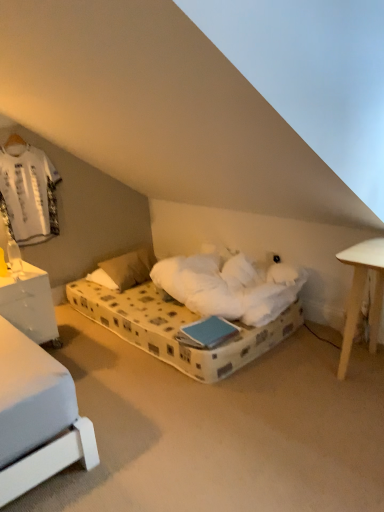
Question: Is white glossy nightstand at left to the left of white plastic table lamp at left from the viewer's perspective?

Choices:
 (A) no
 (B) yes

Answer: (B)

Question: From a real-world perspective, is white glossy nightstand at left located higher than white plastic table lamp at left?

Choices:
 (A) yes
 (B) no

Answer: (B)

Question: Can you see white glossy nightstand at left touching white plastic table lamp at left?

Choices:
 (A) no
 (B) yes

Answer: (A)

Question: From the image's perspective, does white glossy nightstand at left appear lower than white plastic table lamp at left?

Choices:
 (A) yes
 (B) no

Answer: (A)

Question: Would you say white glossy nightstand at left is outside white plastic table lamp at left?

Choices:
 (A) yes
 (B) no

Answer: (A)

Question: Is the position of white glossy nightstand at left less distant than that of white plastic table lamp at left?

Choices:
 (A) yes
 (B) no

Answer: (A)

Question: Could you tell me if white glossy nightstand at left is facing white soft pillow at center?

Choices:
 (A) yes
 (B) no

Answer: (B)

Question: Does white glossy nightstand at left appear on the left side of white soft pillow at center?

Choices:
 (A) no
 (B) yes

Answer: (B)

Question: Does white glossy nightstand at left lie behind white soft pillow at center?

Choices:
 (A) yes
 (B) no

Answer: (B)

Question: Does white glossy nightstand at left have a greater height compared to white soft pillow at center?

Choices:
 (A) yes
 (B) no

Answer: (A)

Question: Is white glossy nightstand at left turned away from white soft pillow at center?

Choices:
 (A) no
 (B) yes

Answer: (A)

Question: Is white glossy nightstand at left far away from white soft pillow at center?

Choices:
 (A) yes
 (B) no

Answer: (B)

Question: Does white plastic table lamp at left have a larger size compared to white glossy nightstand at left?

Choices:
 (A) no
 (B) yes

Answer: (A)